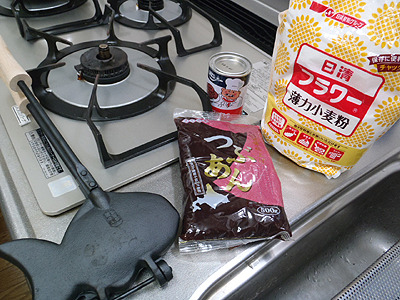
The width and height of the screenshot is (400, 300). What are the coordinates of `sink basin` in the screenshot? It's located at (345, 244).